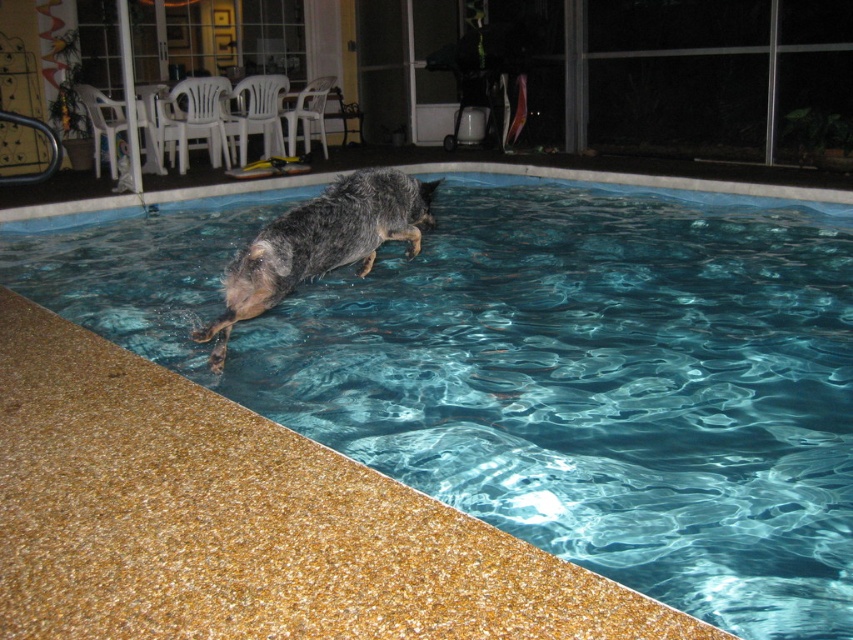
You are a photographer trying to capture the perfect shot of the wet fur dog at center and the clear blue water at center. Based on their positions, which object should you focus on first to ensure both are in frame?

The clear blue water at center is positioned on the right side of wet fur dog at center, so you should focus on the wet fur dog at center first to ensure both are in frame.